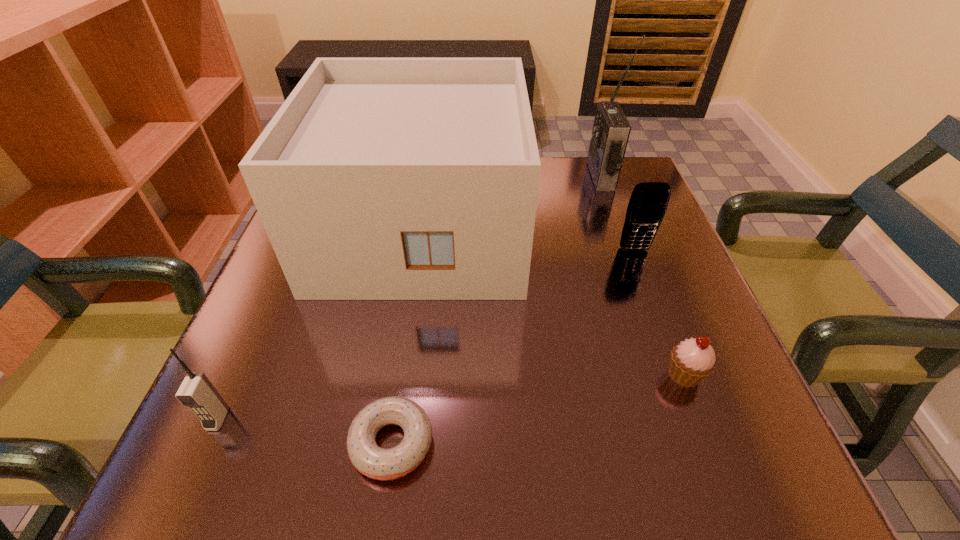
I want to click on box present at the left edge, so click(x=378, y=178).

Image resolution: width=960 pixels, height=540 pixels. In order to click on cellular telephone that is at the left edge in this screenshot , I will do `click(197, 392)`.

Locate an element on the screen. The width and height of the screenshot is (960, 540). radio receiver that is at the right edge is located at coordinates (611, 130).

Where is `cellular telephone that is at the right edge`? Image resolution: width=960 pixels, height=540 pixels. cellular telephone that is at the right edge is located at coordinates (648, 203).

This screenshot has width=960, height=540. Find the location of `cupcake positioned at the right edge`. cupcake positioned at the right edge is located at coordinates (692, 360).

Identify the location of object located at the far left corner. (378, 178).

Locate an element on the screen. object that is at the near left corner is located at coordinates (197, 392).

Locate an element on the screen. object that is at the far right corner is located at coordinates (611, 130).

At what (x,y) coordinates should I click in order to perform the action: click on vacant area at the far edge. Please return your answer as a coordinate pair (x, y). This screenshot has height=540, width=960. Looking at the image, I should click on (545, 188).

The width and height of the screenshot is (960, 540). I want to click on free space at the near edge, so click(505, 443).